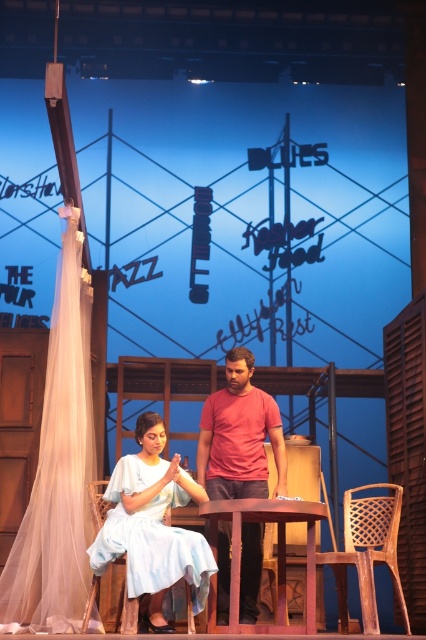
Can you confirm if matte red t-shirt at center is positioned above wooden table at center?

Indeed, matte red t-shirt at center is positioned over wooden table at center.

Does point (224, 403) come behind point (281, 609)?

Yes, point (224, 403) is farther from viewer.

The height and width of the screenshot is (640, 426). Identify the location of matte red t-shirt at center. (238, 435).

From the picture: Who is more distant from viewer, (111,554) or (259,576)?

Positioned behind is point (259,576).

The width and height of the screenshot is (426, 640). I want to click on white cotton dress at center, so click(x=152, y=525).

Is point (94, 544) farther from viewer compared to point (212, 525)?

No.

Measure the distance between point (x=181, y=486) and camera.

They are 5.94 meters apart.

Between point (146, 458) and point (198, 508), which one is positioned behind?

The point (146, 458) is more distant.

Where is `white cotton dress at center`? This screenshot has height=640, width=426. white cotton dress at center is located at coordinates (152, 525).